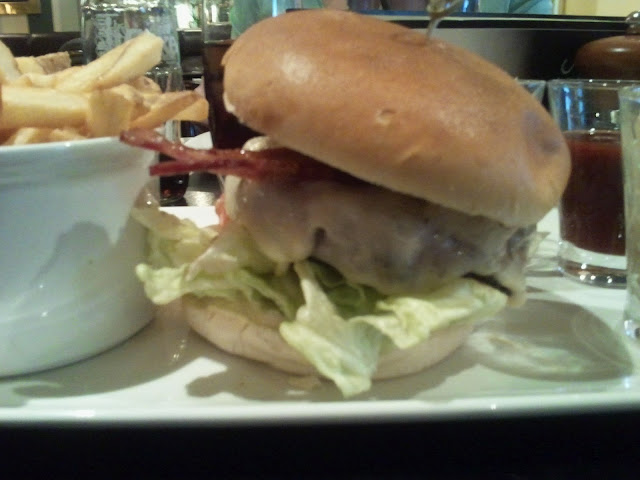
Locate an element on the screen. Image resolution: width=640 pixels, height=480 pixels. plate under burger is located at coordinates (177, 377).